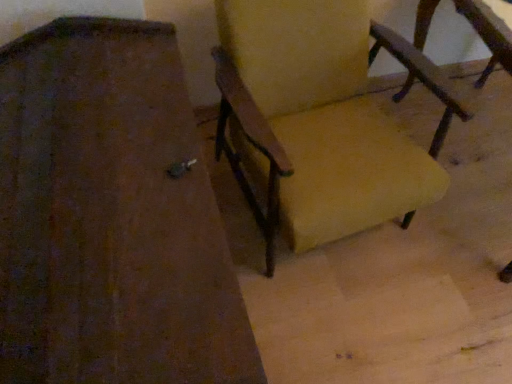
Image resolution: width=512 pixels, height=384 pixels. What do you see at coordinates (321, 118) in the screenshot?
I see `yellow fabric chair at center, marked as the 2th chair in a left-to-right arrangement` at bounding box center [321, 118].

Locate an element on the screen. This screenshot has width=512, height=384. yellow fabric chair at center, marked as the 2th chair in a left-to-right arrangement is located at coordinates point(321,118).

The width and height of the screenshot is (512, 384). What do you see at coordinates (111, 217) in the screenshot? I see `wooden chair at right, the second chair positioned from the right` at bounding box center [111, 217].

Identify the location of wooden chair at right, which appears as the 1th chair when viewed from the left. This screenshot has width=512, height=384. (111, 217).

The height and width of the screenshot is (384, 512). Identify the location of yellow fabric chair at center, marked as the 2th chair in a left-to-right arrangement. (321, 118).

Considering the relative positions of yellow fabric chair at center, marked as the 2th chair in a left-to-right arrangement, and wooden chair at right, which appears as the 1th chair when viewed from the left, in the image provided, is yellow fabric chair at center, marked as the 2th chair in a left-to-right arrangement, to the right of wooden chair at right, which appears as the 1th chair when viewed from the left, from the viewer's perspective?

Yes.

Looking at this image, which object is more forward, yellow fabric chair at center, the first chair in the right-to-left sequence, or wooden chair at right, which appears as the 1th chair when viewed from the left?

wooden chair at right, which appears as the 1th chair when viewed from the left, is closer to the camera.

Does point (296, 206) lie in front of point (190, 257)?

No, (296, 206) is further to viewer.

From the image's perspective, relative to wooden chair at right, which appears as the 1th chair when viewed from the left, is yellow fabric chair at center, marked as the 2th chair in a left-to-right arrangement, above or below?

yellow fabric chair at center, marked as the 2th chair in a left-to-right arrangement, is situated higher than wooden chair at right, which appears as the 1th chair when viewed from the left, in the image.

From a real-world perspective, is yellow fabric chair at center, marked as the 2th chair in a left-to-right arrangement, located beneath wooden chair at right, the second chair positioned from the right?

No.

Can you confirm if yellow fabric chair at center, the first chair in the right-to-left sequence, is wider than wooden chair at right, which appears as the 1th chair when viewed from the left?

No.

Can you confirm if yellow fabric chair at center, the first chair in the right-to-left sequence, is taller than wooden chair at right, the second chair positioned from the right?

Correct, yellow fabric chair at center, the first chair in the right-to-left sequence, is much taller as wooden chair at right, the second chair positioned from the right.

Considering the relative sizes of yellow fabric chair at center, the first chair in the right-to-left sequence, and wooden chair at right, which appears as the 1th chair when viewed from the left, in the image provided, is yellow fabric chair at center, the first chair in the right-to-left sequence, bigger than wooden chair at right, which appears as the 1th chair when viewed from the left,?

No, yellow fabric chair at center, the first chair in the right-to-left sequence, is not bigger than wooden chair at right, which appears as the 1th chair when viewed from the left.

Is yellow fabric chair at center, the first chair in the right-to-left sequence, inside or outside of wooden chair at right, which appears as the 1th chair when viewed from the left?

The correct answer is: outside.

Are yellow fabric chair at center, marked as the 2th chair in a left-to-right arrangement, and wooden chair at right, which appears as the 1th chair when viewed from the left, located far from each other?

That's not correct — yellow fabric chair at center, marked as the 2th chair in a left-to-right arrangement, is a little close to wooden chair at right, which appears as the 1th chair when viewed from the left.

Is yellow fabric chair at center, marked as the 2th chair in a left-to-right arrangement, positioned with its back to wooden chair at right, which appears as the 1th chair when viewed from the left?

That's not correct — yellow fabric chair at center, marked as the 2th chair in a left-to-right arrangement, is not looking away from wooden chair at right, which appears as the 1th chair when viewed from the left.

In the scene shown: What's the angular difference between yellow fabric chair at center, the first chair in the right-to-left sequence, and wooden chair at right, which appears as the 1th chair when viewed from the left,'s facing directions?

The angular difference between yellow fabric chair at center, the first chair in the right-to-left sequence, and wooden chair at right, which appears as the 1th chair when viewed from the left, is 3.61 degrees.

In order to click on chair that appears in front of the yellow fabric chair at center, the first chair in the right-to-left sequence in this screenshot , I will do `click(111, 217)`.

Is wooden chair at right, which appears as the 1th chair when viewed from the left, to the left or to the right of yellow fabric chair at center, the first chair in the right-to-left sequence, in the image?

wooden chair at right, which appears as the 1th chair when viewed from the left, is positioned on yellow fabric chair at center, the first chair in the right-to-left sequence,'s left side.

Is wooden chair at right, which appears as the 1th chair when viewed from the left, further to camera compared to yellow fabric chair at center, marked as the 2th chair in a left-to-right arrangement?

No, it is not.

Is point (1, 283) behind point (251, 22)?

No.

From the image's perspective, between wooden chair at right, which appears as the 1th chair when viewed from the left, and yellow fabric chair at center, marked as the 2th chair in a left-to-right arrangement, which one is located above?

yellow fabric chair at center, marked as the 2th chair in a left-to-right arrangement, from the image's perspective.

From a real-world perspective, is wooden chair at right, which appears as the 1th chair when viewed from the left, physically located above or below yellow fabric chair at center, the first chair in the right-to-left sequence?

From a real-world perspective, wooden chair at right, which appears as the 1th chair when viewed from the left, is physically below yellow fabric chair at center, the first chair in the right-to-left sequence.

Does wooden chair at right, the second chair positioned from the right, have a greater width compared to yellow fabric chair at center, the first chair in the right-to-left sequence?

Yes, wooden chair at right, the second chair positioned from the right, is wider than yellow fabric chair at center, the first chair in the right-to-left sequence.

Is wooden chair at right, which appears as the 1th chair when viewed from the left, shorter than yellow fabric chair at center, marked as the 2th chair in a left-to-right arrangement?

Correct, wooden chair at right, which appears as the 1th chair when viewed from the left, is not as tall as yellow fabric chair at center, marked as the 2th chair in a left-to-right arrangement.

Is wooden chair at right, which appears as the 1th chair when viewed from the left, bigger than yellow fabric chair at center, marked as the 2th chair in a left-to-right arrangement?

Indeed, wooden chair at right, which appears as the 1th chair when viewed from the left, has a larger size compared to yellow fabric chair at center, marked as the 2th chair in a left-to-right arrangement.

Is yellow fabric chair at center, marked as the 2th chair in a left-to-right arrangement, inside wooden chair at right, the second chair positioned from the right?

That's incorrect, yellow fabric chair at center, marked as the 2th chair in a left-to-right arrangement, is not inside wooden chair at right, the second chair positioned from the right.

Is wooden chair at right, the second chair positioned from the right, positioned far away from yellow fabric chair at center, marked as the 2th chair in a left-to-right arrangement?

Actually, wooden chair at right, the second chair positioned from the right, and yellow fabric chair at center, marked as the 2th chair in a left-to-right arrangement, are a little close together.

Could you tell me if wooden chair at right, the second chair positioned from the right, is turned towards yellow fabric chair at center, marked as the 2th chair in a left-to-right arrangement?

No, wooden chair at right, the second chair positioned from the right, does not turn towards yellow fabric chair at center, marked as the 2th chair in a left-to-right arrangement.

How different are the orientations of wooden chair at right, which appears as the 1th chair when viewed from the left, and yellow fabric chair at center, marked as the 2th chair in a left-to-right arrangement, in degrees?

They differ by 3.61 degrees in their facing directions.

How distant is wooden chair at right, the second chair positioned from the right, from yellow fabric chair at center, marked as the 2th chair in a left-to-right arrangement?

The distance of wooden chair at right, the second chair positioned from the right, from yellow fabric chair at center, marked as the 2th chair in a left-to-right arrangement, is 17.35 inches.

Locate an element on the screen. chair lying below the yellow fabric chair at center, the first chair in the right-to-left sequence (from the image's perspective) is located at coordinates (111, 217).

Where is `chair on the right of wooden chair at right, the second chair positioned from the right`? The height and width of the screenshot is (384, 512). chair on the right of wooden chair at right, the second chair positioned from the right is located at coordinates (321, 118).

You are a GUI agent. You are given a task and a screenshot of the screen. Output one action in this format:
    pyautogui.click(x=<x>, y=<y>)
    Task: Click on the chair in front of the yellow fabric chair at center, marked as the 2th chair in a left-to-right arrangement
    
    Given the screenshot: What is the action you would take?
    pyautogui.click(x=111, y=217)